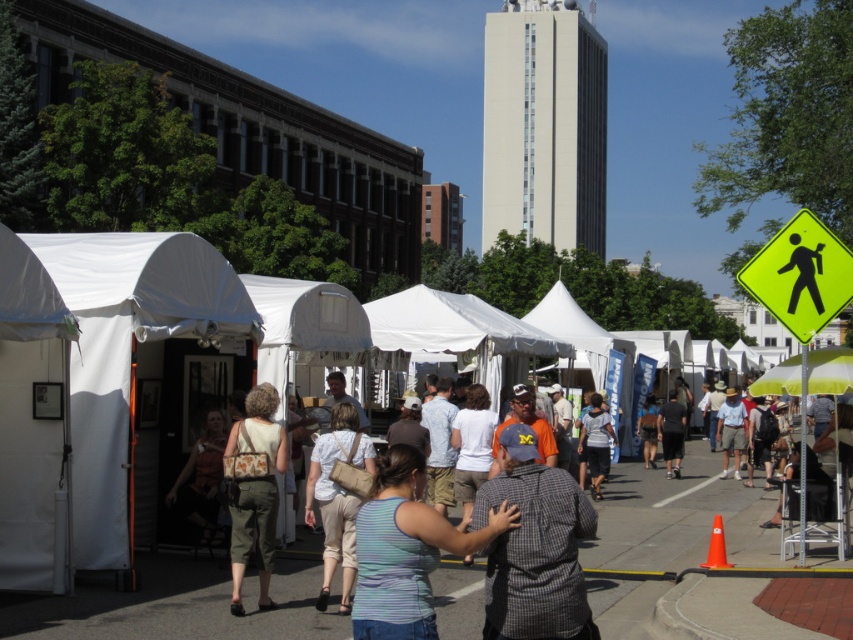
You are standing at the point labeled as point (x=726, y=476) and want to walk towards the point labeled as point (x=817, y=326). Which direction should you move relative to your current position?

You should move forward because point (x=817, y=326) is in front of point (x=726, y=476) from your perspective.

You are at the outdoor market and want to find the beige fabric purse at center. According to the scene description, where exactly is it located?

The beige fabric purse at center is located at point (337, 497) in the image.